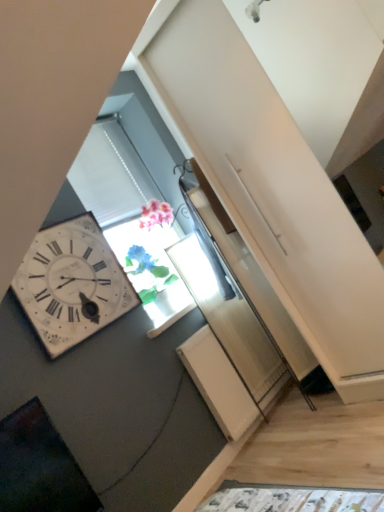
Question: From a real-world perspective, is white wooden wall clock at left positioned above or below translucent glass vase at center?

Choices:
 (A) below
 (B) above

Answer: (B)

Question: Is white wooden wall clock at left inside the boundaries of translucent glass vase at center, or outside?

Choices:
 (A) inside
 (B) outside

Answer: (B)

Question: Considering the positions of white wooden wall clock at left and translucent glass vase at center in the image, is white wooden wall clock at left taller or shorter than translucent glass vase at center?

Choices:
 (A) tall
 (B) short

Answer: (A)

Question: From a real-world perspective, relative to white wooden wall clock at left, is translucent glass vase at center vertically above or below?

Choices:
 (A) below
 (B) above

Answer: (A)

Question: Does point (183, 295) appear closer or farther from the camera than point (66, 245)?

Choices:
 (A) farther
 (B) closer

Answer: (A)

Question: From the image's perspective, is translucent glass vase at center positioned above or below white wooden wall clock at left?

Choices:
 (A) below
 (B) above

Answer: (B)

Question: Considering the positions of translucent glass vase at center and white wooden wall clock at left in the image, is translucent glass vase at center taller or shorter than white wooden wall clock at left?

Choices:
 (A) short
 (B) tall

Answer: (A)